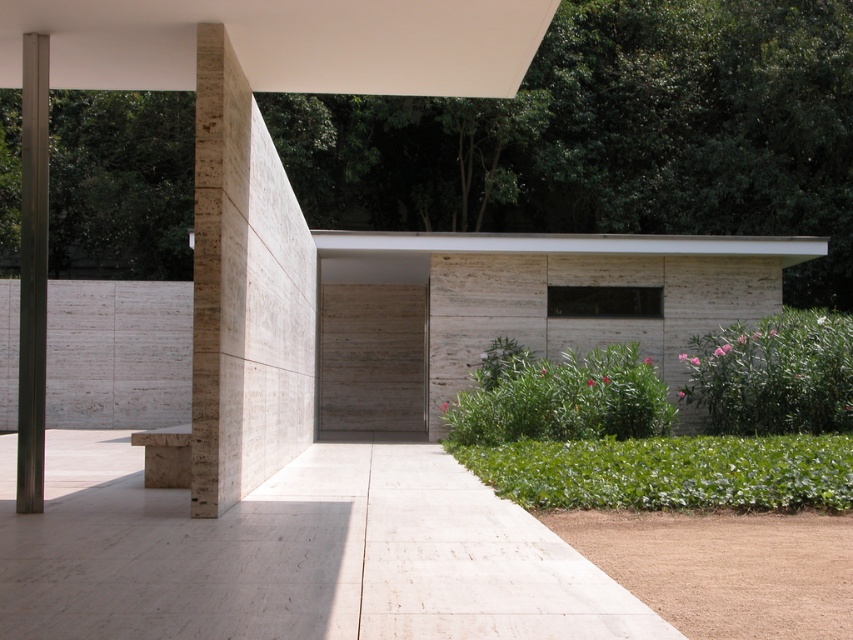
Does white marble path at center appear over beige stone pillar at center?

No.

Is white marble path at center to the right of beige stone pillar at center from the viewer's perspective?

Correct, you'll find white marble path at center to the right of beige stone pillar at center.

This screenshot has width=853, height=640. In order to click on white marble path at center in this screenshot , I will do `click(294, 554)`.

Which of these two, beige stone pillar at center or metallic gray pole at left, stands shorter?

metallic gray pole at left is shorter.

Is point (224, 381) more distant than point (25, 259)?

That is True.

Is point (198, 328) positioned after point (20, 422)?

No, (198, 328) is in front of (20, 422).

This screenshot has height=640, width=853. I want to click on beige stone pillar at center, so click(x=244, y=292).

Is point (369, 627) positioned after point (38, 172)?

That is False.

Between white marble path at center and metallic gray pole at left, which one appears on the right side from the viewer's perspective?

white marble path at center is more to the right.

Between point (97, 452) and point (39, 234), which one is positioned behind?

The point (97, 452) is more distant.

I want to click on white marble path at center, so click(x=294, y=554).